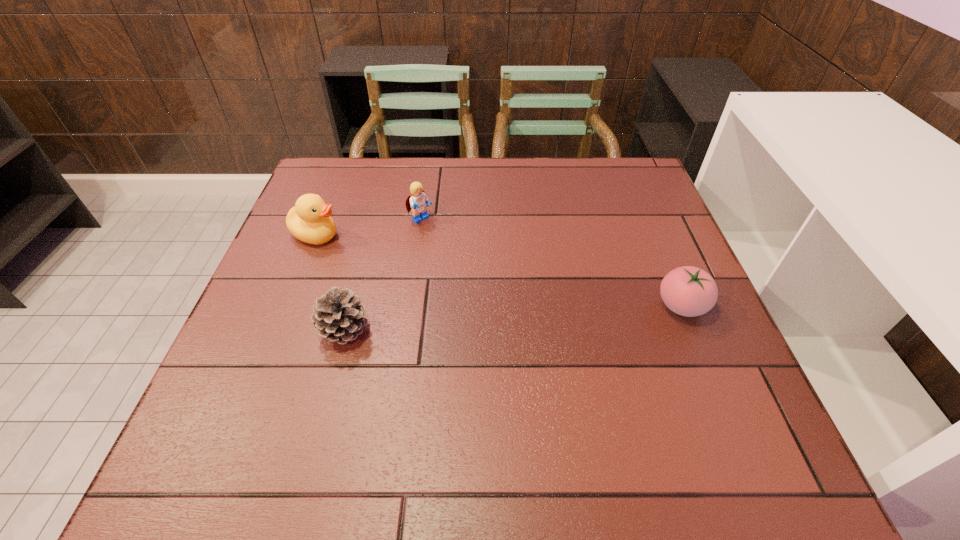
Locate an element on the screen. free area in between the duck and the rightmost object is located at coordinates (499, 270).

Image resolution: width=960 pixels, height=540 pixels. What are the coordinates of `free space between the leftmost object and the Lego` in the screenshot? It's located at (369, 227).

Image resolution: width=960 pixels, height=540 pixels. In order to click on free space between the second object from left to right and the duck in this screenshot , I will do `click(330, 282)`.

Identify the location of object that is the third closest to the third object from left to right. (689, 291).

In order to click on the second closest object to the pinecone in this screenshot , I will do `click(417, 201)`.

In order to click on blank space that satisfies the following two spatial constraints: 1. on the back side of the Lego; 2. on the right side of the third object from right to left in this screenshot , I will do `click(373, 220)`.

Locate an element on the screen. vacant space that satisfies the following two spatial constraints: 1. on the back side of the second object from left to right; 2. on the right side of the Lego is located at coordinates (373, 220).

You are a GUI agent. You are given a task and a screenshot of the screen. Output one action in this format:
    pyautogui.click(x=<x>, y=<y>)
    Task: Click on the free space that satisfies the following two spatial constraints: 1. on the back side of the pinecone; 2. on the left side of the second object from right to left
    
    Given the screenshot: What is the action you would take?
    pyautogui.click(x=373, y=220)

Identify the location of free region that satisfies the following two spatial constraints: 1. on the front side of the leftmost object; 2. on the left side of the pinecone. (278, 330).